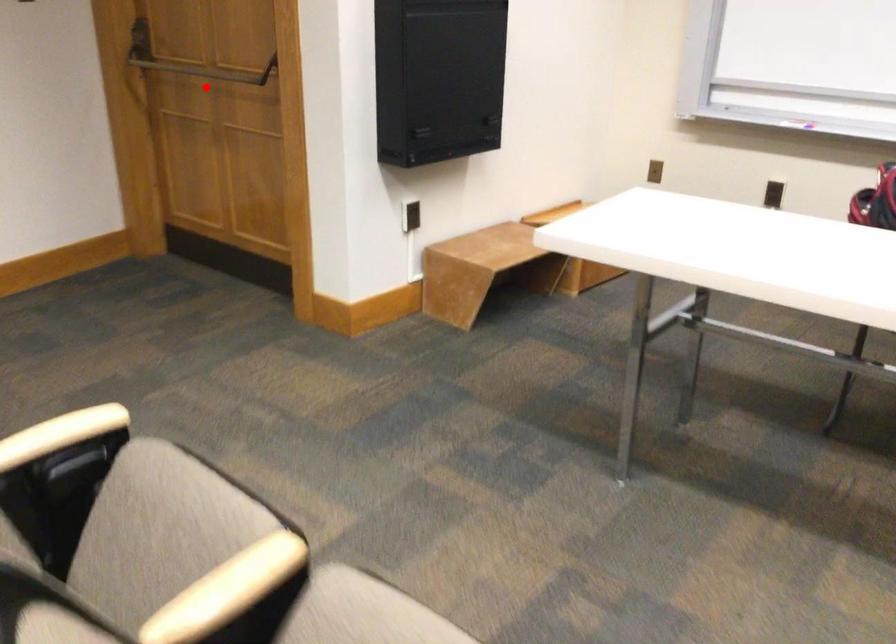
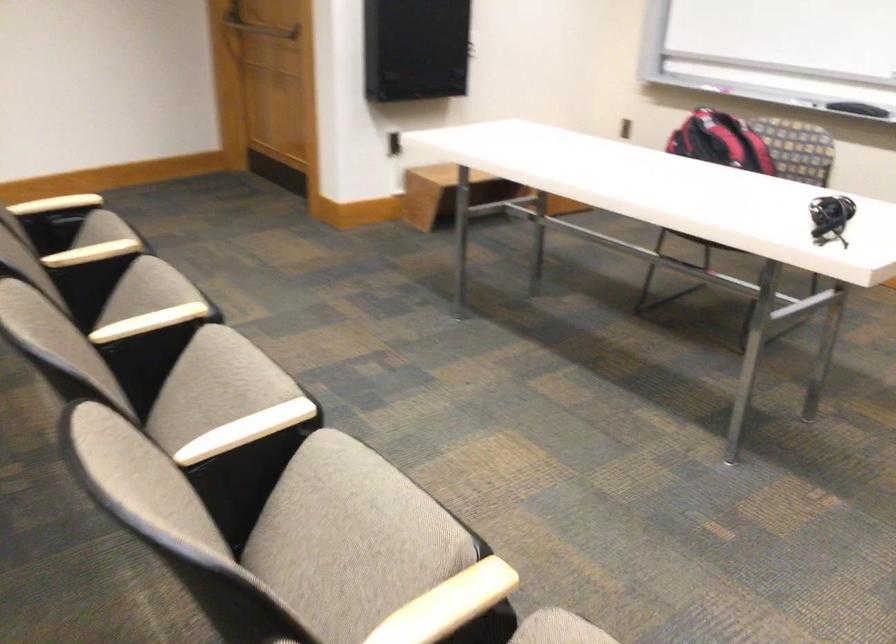
Question: I am providing you with two images of the same scene from different viewpoints. Image1 has a red point marked. In image2, the corresponding 3D location appears at what relative position? Reply with the corresponding letter.

Choices:
 (A) Closer
 (B) Farther

Answer: (B)